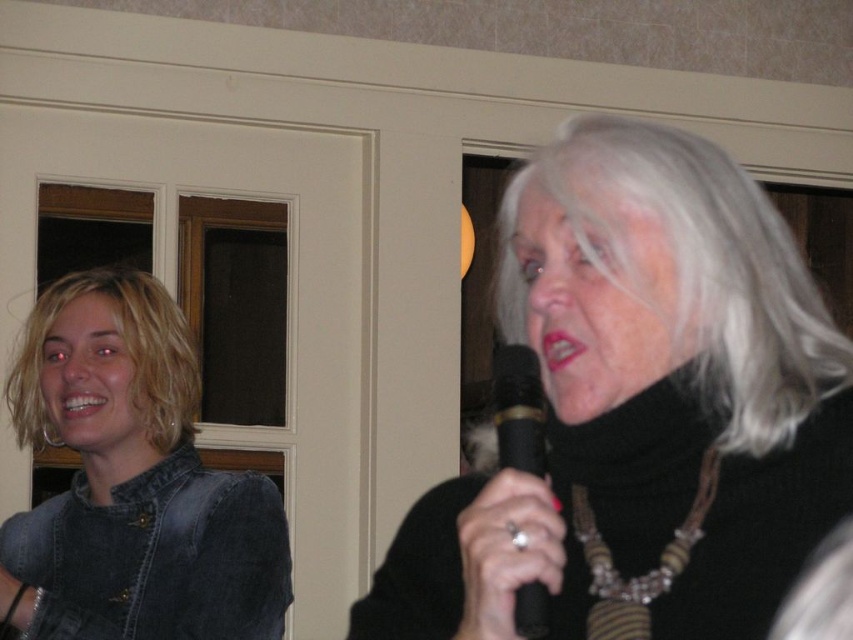
Is blondehair at left to the right of black metallic microphone at center from the viewer's perspective?

Incorrect, blondehair at left is not on the right side of black metallic microphone at center.

Between point (134, 384) and point (531, 451), which one is positioned behind?

Point (134, 384)

Where is `blondehair at left`? This screenshot has width=853, height=640. blondehair at left is located at coordinates (120, 348).

Is gray matte hair at upper right further to camera compared to brown wooden beads at center?

Yes, it is.

Can you confirm if gray matte hair at upper right is taller than brown wooden beads at center?

Yes.

Is point (669, 241) more distant than point (636, 614)?

Yes, point (669, 241) is behind point (636, 614).

This screenshot has width=853, height=640. I want to click on gray matte hair at upper right, so click(x=689, y=269).

Who is positioned more to the left, gray matte hair at upper right or black metallic microphone at center?

black metallic microphone at center is more to the left.

Who is more distant from viewer, (590, 166) or (544, 445)?

Positioned behind is point (544, 445).

Identify the location of gray matte hair at upper right. The width and height of the screenshot is (853, 640). (689, 269).